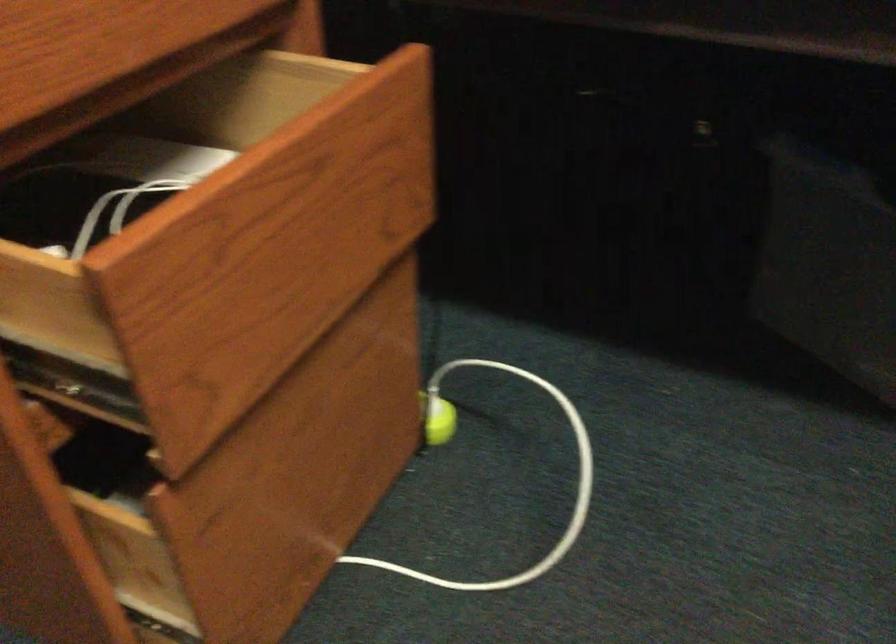
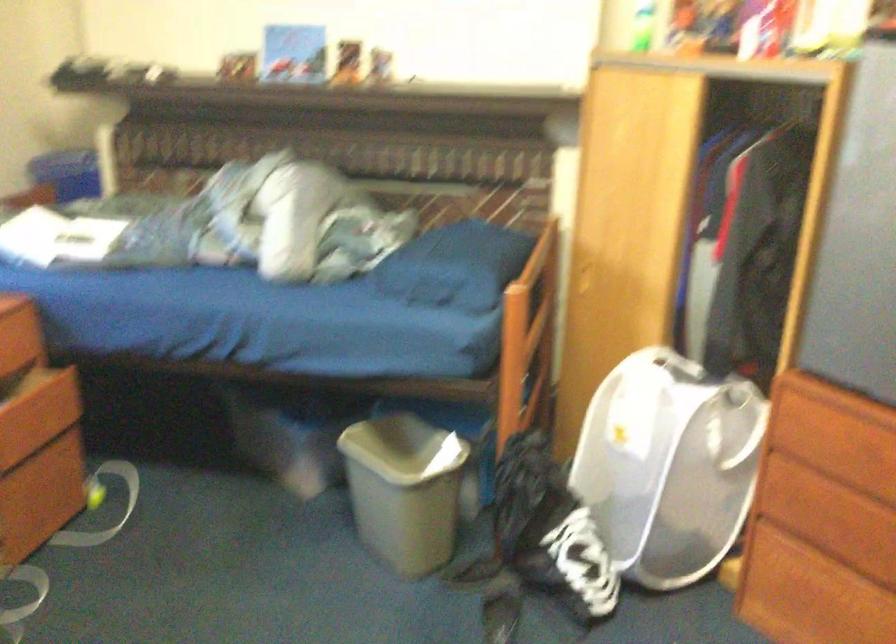
Where in the second image is the point corresponding to pixel 332 251 from the first image?

(39, 413)